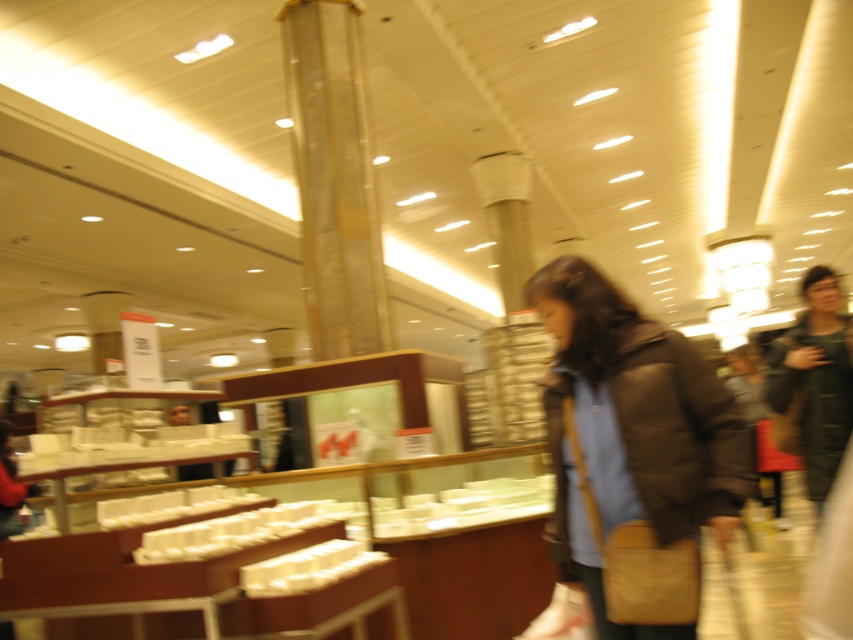
Question: Which object is closer to the camera taking this photo?

Choices:
 (A) dark brown leather jacket at right
 (B) matte black jacket at center

Answer: (B)

Question: Does matte black jacket at center have a lesser width compared to dark brown leather jacket at right?

Choices:
 (A) no
 (B) yes

Answer: (A)

Question: Which of the following is the farthest from the observer?

Choices:
 (A) (624, 378)
 (B) (770, 384)

Answer: (B)

Question: Does matte black jacket at center have a larger size compared to dark brown leather jacket at right?

Choices:
 (A) no
 (B) yes

Answer: (A)

Question: Which object is closer to the camera taking this photo?

Choices:
 (A) matte black jacket at center
 (B) dark brown leather jacket at right

Answer: (A)

Question: In this image, where is matte black jacket at center located relative to dark brown leather jacket at right?

Choices:
 (A) above
 (B) below

Answer: (B)